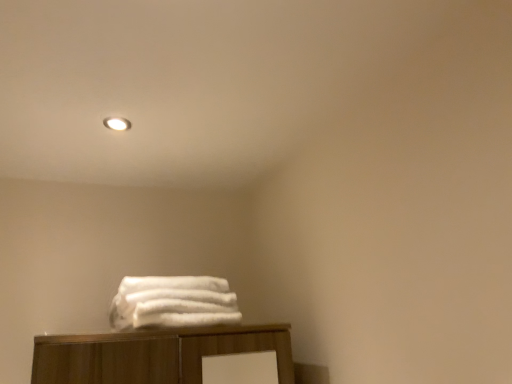
At what (x,y) coordinates should I click in order to perform the action: click on free space to the right of matte white light fixture at upper center. Please return your answer as a coordinate pair (x, y). The image size is (512, 384). Looking at the image, I should click on (165, 119).